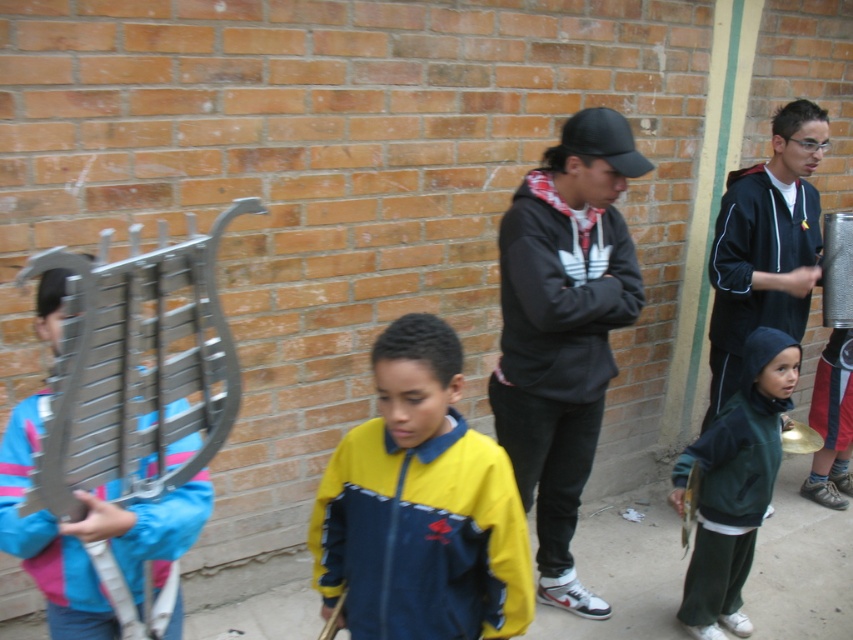
Does metallic silver lyre at left have a smaller size compared to dark green fleece jacket at lower right?

No, metallic silver lyre at left is not smaller than dark green fleece jacket at lower right.

Between point (74, 266) and point (726, 602), which one is positioned behind?

The point (726, 602) is more distant.

Who is more distant from viewer, (200, 246) or (756, 388)?

Positioned behind is point (756, 388).

Where is `metallic silver lyre at left`? metallic silver lyre at left is located at coordinates (137, 369).

Can you confirm if dark green fleece jacket at lower right is smaller than gold metallic bell at lower right?

No, dark green fleece jacket at lower right is not smaller than gold metallic bell at lower right.

Is dark green fleece jacket at lower right above gold metallic bell at lower right?

Yes, dark green fleece jacket at lower right is above gold metallic bell at lower right.

Does point (778, 330) lie behind point (682, 508)?

Yes, point (778, 330) is behind point (682, 508).

Where is `dark green fleece jacket at lower right`? The height and width of the screenshot is (640, 853). dark green fleece jacket at lower right is located at coordinates (734, 484).

Is point (532, 388) in front of point (691, 483)?

That is True.

Does black matte jacket at center have a greater height compared to gold metallic bell at lower right?

Correct, black matte jacket at center is much taller as gold metallic bell at lower right.

Between point (579, 355) and point (685, 545), which one is positioned behind?

Point (685, 545)

Where is `black matte jacket at center`? The image size is (853, 640). black matte jacket at center is located at coordinates (563, 330).